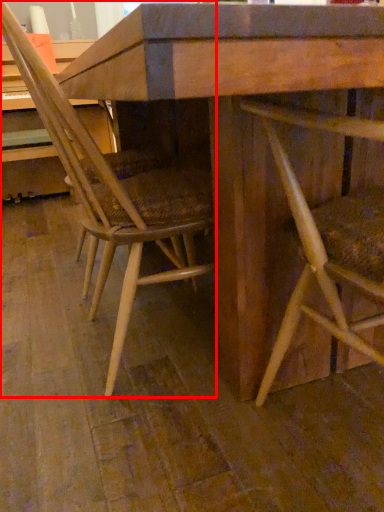
Question: From the image's perspective, considering the relative positions of chair (annotated by the red box) and chair in the image provided, where is chair (annotated by the red box) located with respect to the staircase?

Choices:
 (A) below
 (B) above

Answer: (B)